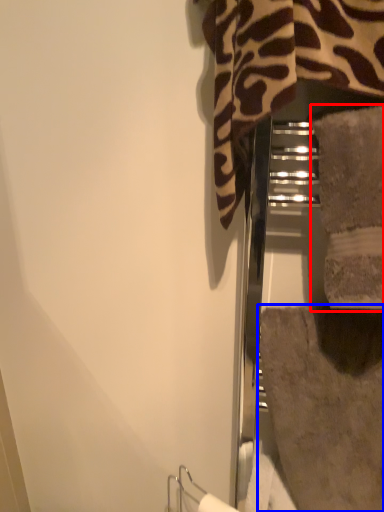
Question: Which point is further to the camera, towel (highlighted by a red box) or bath towel (highlighted by a blue box)?

Choices:
 (A) towel
 (B) bath towel

Answer: (B)